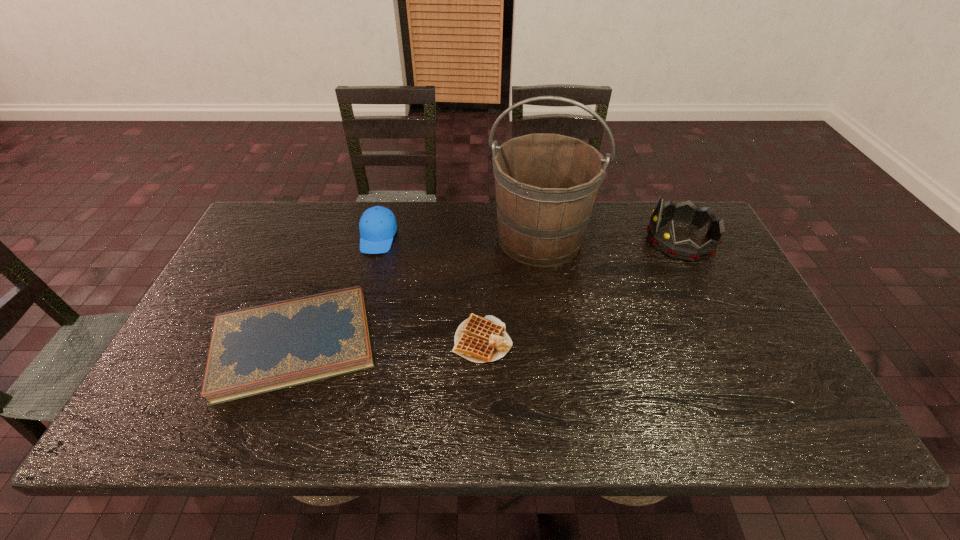
Find the location of a particular element. bucket is located at coordinates (546, 184).

The image size is (960, 540). Find the location of `tiara`. tiara is located at coordinates (663, 239).

Locate an element on the screen. the fourth shortest object is located at coordinates (663, 239).

Find the location of a particular element. The width and height of the screenshot is (960, 540). the third shortest object is located at coordinates (377, 225).

Identify the location of paperback book. click(254, 350).

You are a GUI agent. You are given a task and a screenshot of the screen. Output one action in this format:
    pyautogui.click(x=<x>, y=<y>)
    Task: Click on the waffle
    This screenshot has height=540, width=960.
    Given the screenshot: What is the action you would take?
    pyautogui.click(x=478, y=339)

Locate an element on the screen. vacant position located 0.270m on the right of the bucket is located at coordinates (678, 238).

Where is `vacant position located at the front of the tiara with jewels`? The image size is (960, 540). vacant position located at the front of the tiara with jewels is located at coordinates (627, 240).

Find the location of a particular element. Image resolution: width=960 pixels, height=540 pixels. free space located at the front of the tiara with jewels is located at coordinates (617, 240).

The image size is (960, 540). What are the coordinates of `free space located 0.350m at the front of the tiara with jewels` in the screenshot? It's located at (534, 240).